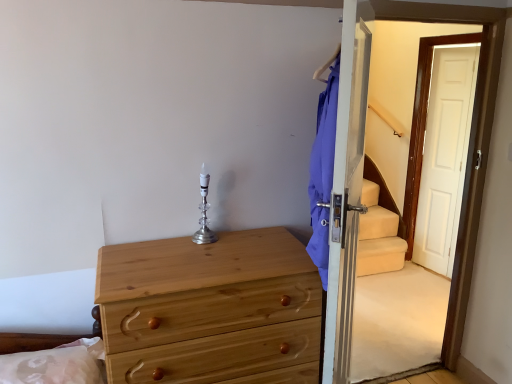
Locate an element on the screen. This screenshot has height=384, width=512. vacant area located to the right-hand side of silver/crystal candle holder at center is located at coordinates (240, 241).